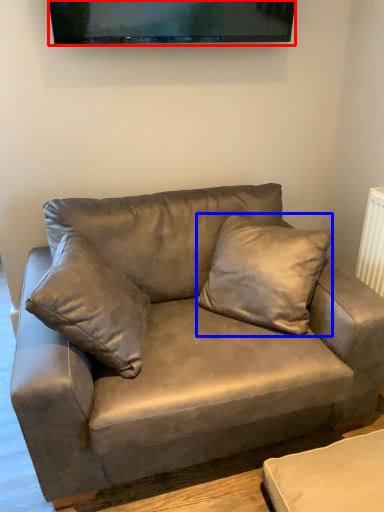
Question: Which object appears closest to the camera in this image, television (highlighted by a red box) or pillow (highlighted by a blue box)?

Choices:
 (A) television
 (B) pillow

Answer: (B)